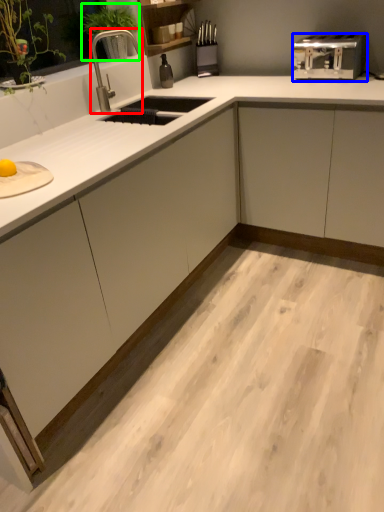
Question: Considering the real-world distances, which object is farthest from faucet (highlighted by a red box)? toaster (highlighted by a blue box) or plant (highlighted by a green box)?

Choices:
 (A) toaster
 (B) plant

Answer: (A)